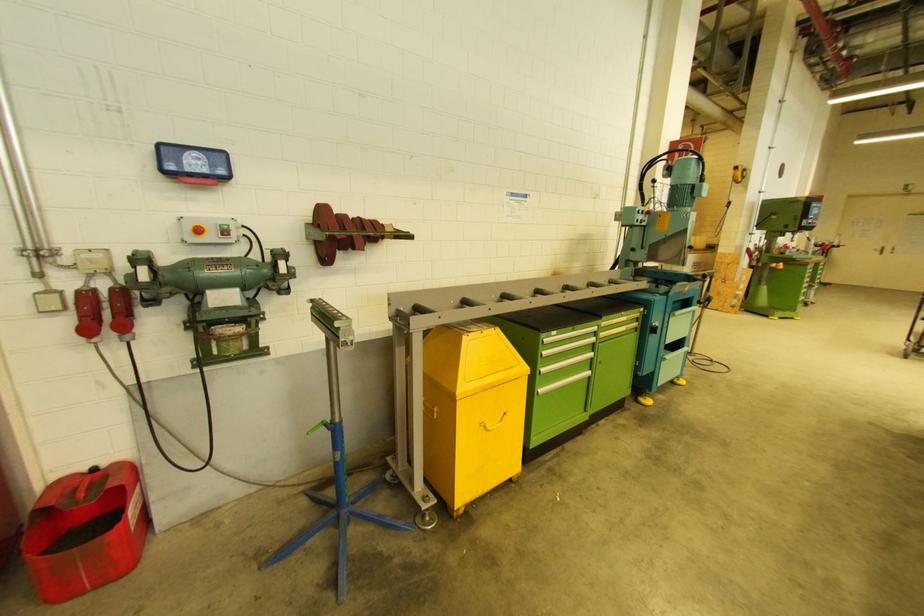
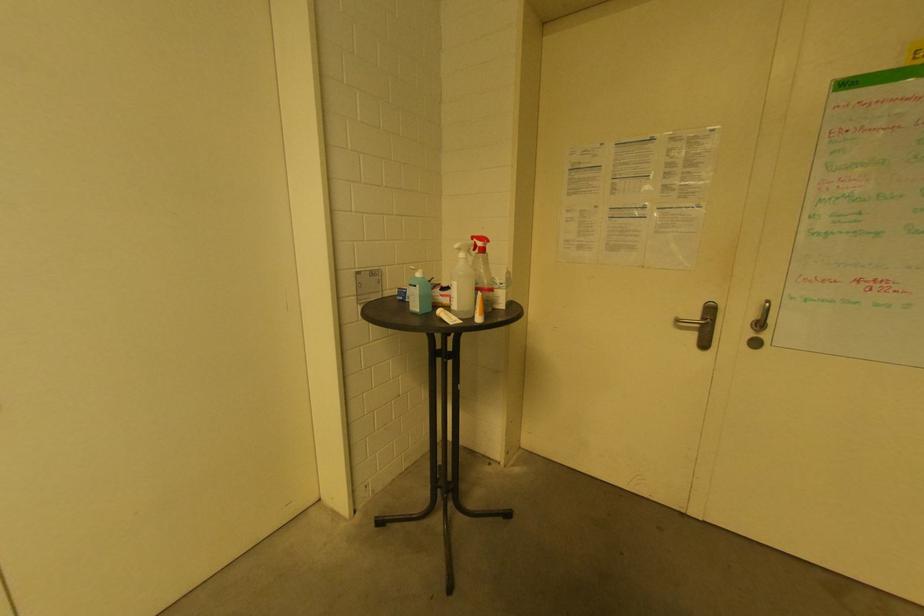
Locate, in the second image, the point that corresponds to (895,252) in the first image.

(761, 326)